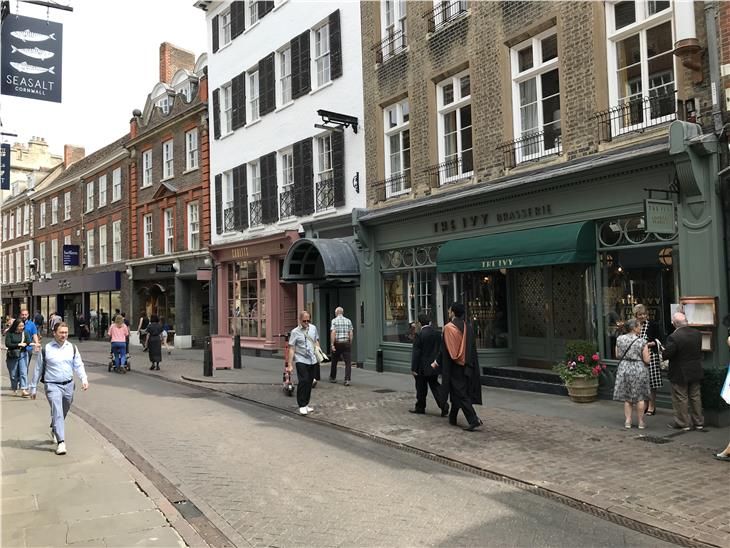
The image size is (730, 548). I want to click on planter, so click(x=580, y=392).